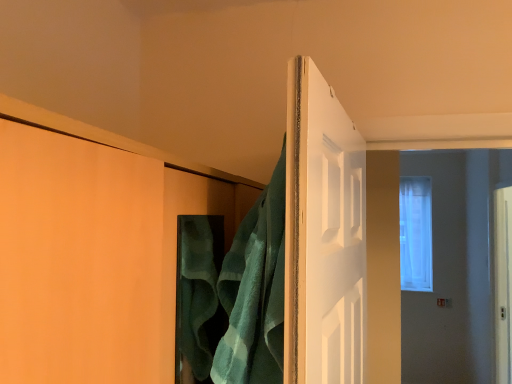
Where is `translucent glass window at upper right`? This screenshot has height=384, width=512. translucent glass window at upper right is located at coordinates (416, 234).

Describe the element at coordinates (416, 234) in the screenshot. The image size is (512, 384). I see `translucent glass window at upper right` at that location.

Describe the element at coordinates (255, 292) in the screenshot. I see `green terry cloth towel at center` at that location.

Measure the distance between green terry cloth towel at center and camera.

The depth of green terry cloth towel at center is 25.04 inches.

At what (x,y) coordinates should I click in order to perform the action: click on green terry cloth towel at center. Please return your answer as a coordinate pair (x, y). The image size is (512, 384). Looking at the image, I should click on (255, 292).

The width and height of the screenshot is (512, 384). I want to click on translucent glass window at upper right, so click(416, 234).

Considering the positions of objects green terry cloth towel at center and translucent glass window at upper right in the image provided, who is more to the left, green terry cloth towel at center or translucent glass window at upper right?

green terry cloth towel at center.

Is the depth of green terry cloth towel at center less than that of translucent glass window at upper right?

Yes.

Is point (260, 356) closer or farther from the camera than point (418, 222)?

Point (260, 356) appears to be closer to the viewer than point (418, 222).

From the image's perspective, which object appears higher, green terry cloth towel at center or translucent glass window at upper right?

green terry cloth towel at center, from the image's perspective.

From a real-world perspective, is green terry cloth towel at center above or below translucent glass window at upper right?

From a real-world perspective, green terry cloth towel at center is physically below translucent glass window at upper right.

In terms of width, does green terry cloth towel at center look wider or thinner when compared to translucent glass window at upper right?

green terry cloth towel at center is thinner than translucent glass window at upper right.

Which of these two, green terry cloth towel at center or translucent glass window at upper right, stands taller?

translucent glass window at upper right is taller.

Is green terry cloth towel at center bigger than translucent glass window at upper right?

Actually, green terry cloth towel at center might be smaller than translucent glass window at upper right.

In the scene shown: Would you say translucent glass window at upper right is part of green terry cloth towel at center's contents?

No, translucent glass window at upper right is not surrounded by green terry cloth towel at center.

Is green terry cloth towel at center with translucent glass window at upper right?

No, green terry cloth towel at center is not next to translucent glass window at upper right.

Could you tell me if green terry cloth towel at center is turned towards translucent glass window at upper right?

No, green terry cloth towel at center is not aimed at translucent glass window at upper right.

Can you tell me how much green terry cloth towel at center and translucent glass window at upper right differ in facing direction?

There is a 82.6-degree angle between the facing directions of green terry cloth towel at center and translucent glass window at upper right.

Measure the distance from green terry cloth towel at center to translucent glass window at upper right.

green terry cloth towel at center and translucent glass window at upper right are 4.15 meters apart.

Identify the location of bath towel below the translucent glass window at upper right (from a real-world perspective). (255, 292).

Is translucent glass window at upper right to the right of green terry cloth towel at center from the viewer's perspective?

Correct, you'll find translucent glass window at upper right to the right of green terry cloth towel at center.

Considering their positions, is translucent glass window at upper right located in front of or behind green terry cloth towel at center?

Visually, translucent glass window at upper right is located behind green terry cloth towel at center.

Which is nearer, (428, 273) or (245, 296)?

The point (245, 296) is more forward.

From the image's perspective, relative to green terry cloth towel at center, is translucent glass window at upper right above or below?

Clearly, from the image's perspective, translucent glass window at upper right is below green terry cloth towel at center.

From a real-world perspective, is translucent glass window at upper right on green terry cloth towel at center?

Yes, from a real-world perspective, translucent glass window at upper right is on top of green terry cloth towel at center.

Considering the sizes of objects translucent glass window at upper right and green terry cloth towel at center in the image provided, who is wider, translucent glass window at upper right or green terry cloth towel at center?

translucent glass window at upper right.

Who is taller, translucent glass window at upper right or green terry cloth towel at center?

With more height is translucent glass window at upper right.

Looking at the image, does translucent glass window at upper right seem bigger or smaller compared to green terry cloth towel at center?

translucent glass window at upper right is bigger than green terry cloth towel at center.

From the picture: Do you think translucent glass window at upper right is within green terry cloth towel at center, or outside of it?

translucent glass window at upper right is spatially situated outside green terry cloth towel at center.

Is translucent glass window at upper right positioned far away from green terry cloth towel at center?

That's right, there is a large distance between translucent glass window at upper right and green terry cloth towel at center.

Is translucent glass window at upper right looking in the opposite direction of green terry cloth towel at center?

No.

Can you tell me how much translucent glass window at upper right and green terry cloth towel at center differ in facing direction?

The angular difference between translucent glass window at upper right and green terry cloth towel at center is 82.6 degrees.

I want to click on bath towel that is above the translucent glass window at upper right (from the image's perspective), so click(255, 292).

Locate an element on the screen. The image size is (512, 384). window behind the green terry cloth towel at center is located at coordinates (416, 234).

Locate an element on the screen. This screenshot has width=512, height=384. bath towel to the left of translucent glass window at upper right is located at coordinates (255, 292).